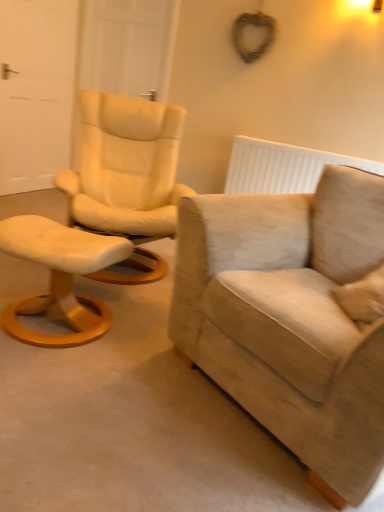
Measure the distance between point (x=259, y=260) and camera.

The distance of point (x=259, y=260) from camera is 1.69 meters.

The image size is (384, 512). What do you see at coordinates (282, 167) in the screenshot?
I see `white textured radiator at upper right` at bounding box center [282, 167].

Find the location of `white fabric stool at left`. white fabric stool at left is located at coordinates (60, 277).

Is beige fabric armchair at right directly adjacent to white wood door at upper left, the 1th door positioned from the right?

No, beige fabric armchair at right is not making contact with white wood door at upper left, the 1th door positioned from the right.

Looking at their sizes, would you say beige fabric armchair at right is wider or thinner than white wood door at upper left, which appears as the 2th door when viewed from the left?

Clearly, beige fabric armchair at right has more width compared to white wood door at upper left, which appears as the 2th door when viewed from the left.

How different are the orientations of beige fabric armchair at right and white wood door at upper left, the 1th door positioned from the right, in degrees?

The facing directions of beige fabric armchair at right and white wood door at upper left, the 1th door positioned from the right, are 26.9 degrees apart.

Can you confirm if beige fabric armchair at right is bigger than white wood door at upper left, which appears as the 2th door when viewed from the left?

Indeed, beige fabric armchair at right has a larger size compared to white wood door at upper left, which appears as the 2th door when viewed from the left.

From the image's perspective, is white wood door at upper left, the 1th door positioned from the right, located above beige fabric armchair at right?

Yes.

Can you see white wood door at upper left, which appears as the 2th door when viewed from the left, touching beige fabric armchair at right?

No, white wood door at upper left, which appears as the 2th door when viewed from the left, is not with beige fabric armchair at right.

Could you tell me if white wood door at upper left, the 1th door positioned from the right, is turned towards beige fabric armchair at right?

No, white wood door at upper left, the 1th door positioned from the right, is not oriented towards beige fabric armchair at right.

From a real-world perspective, does white wood door at upper left, the 1th door positioned from the right, sit lower than beige fabric armchair at right?

No, from a real-world perspective, white wood door at upper left, the 1th door positioned from the right, is not under beige fabric armchair at right.

Looking at this image, does white fabric stool at left have a smaller size compared to beige fabric armchair at right?

Yes, white fabric stool at left is smaller than beige fabric armchair at right.

Is white fabric stool at left behind beige fabric armchair at right?

Yes, white fabric stool at left is behind beige fabric armchair at right.

Is white fabric stool at left with beige fabric armchair at right?

No, white fabric stool at left is not beside beige fabric armchair at right.

Are white textured radiator at upper right and white wood door at upper left, which appears as the 2th door when viewed from the left, making contact?

No, white textured radiator at upper right is not with white wood door at upper left, which appears as the 2th door when viewed from the left.

From the image's perspective, which one is positioned lower, white textured radiator at upper right or white wood door at upper left, which appears as the 2th door when viewed from the left?

white textured radiator at upper right, from the image's perspective.

Is white textured radiator at upper right facing towards white wood door at upper left, which appears as the 2th door when viewed from the left?

No, white textured radiator at upper right is not turned towards white wood door at upper left, which appears as the 2th door when viewed from the left.

Which point is more forward, (243,173) or (94,73)?

Positioned in front is point (243,173).

Is beige fabric armchair at right directly adjacent to white fabric stool at left?

beige fabric armchair at right and white fabric stool at left are clearly separated.

Is beige fabric armchair at right wider than white fabric stool at left?

Indeed, beige fabric armchair at right has a greater width compared to white fabric stool at left.

Is point (314, 268) positioned after point (121, 251)?

Yes, point (314, 268) is behind point (121, 251).

Between white fabric stool at left and white wood door at upper left, which appears as the 2th door when viewed from the left, which one is positioned behind?

white wood door at upper left, which appears as the 2th door when viewed from the left, is behind.

Considering the relative sizes of white fabric stool at left and white wood door at upper left, which appears as the 2th door when viewed from the left, in the image provided, is white fabric stool at left shorter than white wood door at upper left, which appears as the 2th door when viewed from the left,?

Yes, white fabric stool at left is shorter than white wood door at upper left, which appears as the 2th door when viewed from the left.

How different are the orientations of white fabric stool at left and white wood door at upper left, which appears as the 2th door when viewed from the left, in degrees?

9.55 degrees.

Does white fabric stool at left have a larger size compared to white matte door at left, marked as the 2th door in a right-to-left arrangement?

Incorrect, white fabric stool at left is not larger than white matte door at left, marked as the 2th door in a right-to-left arrangement.

Is white fabric stool at left next to white matte door at left, the first door in the left-to-right sequence?

white fabric stool at left and white matte door at left, the first door in the left-to-right sequence, are clearly separated.

Which point is more distant from viewer, (115, 248) or (28, 6)?

The point (28, 6) is more distant.

The width and height of the screenshot is (384, 512). What are the coordinates of `chair below the white wood door at upper left, which appears as the 2th door when viewed from the left (from a real-world perspective)` in the screenshot? It's located at (290, 317).

From the image's perspective, count 2nd doors upward from the beige fabric armchair at right and point to it. Please provide its 2D coordinates.

[(127, 46)]

When comparing their distances from beige fabric armchair at right, does white fabric stool at left or white matte door at left, marked as the 2th door in a right-to-left arrangement, seem further?

Based on the image, white matte door at left, marked as the 2th door in a right-to-left arrangement, appears to be further to beige fabric armchair at right.

Which object lies nearer to the anchor point white fabric stool at left, white wood door at upper left, the 1th door positioned from the right, or white textured radiator at upper right?

The object closer to white fabric stool at left is white textured radiator at upper right.

Looking at the image, which one is located closer to white fabric stool at left, beige fabric armchair at right or white textured radiator at upper right?

Based on the image, beige fabric armchair at right appears to be nearer to white fabric stool at left.

Estimate the real-world distances between objects in this image. Which object is closer to white matte door at left, the first door in the left-to-right sequence, white fabric stool at left or white wood door at upper left, which appears as the 2th door when viewed from the left?

Based on the image, white wood door at upper left, which appears as the 2th door when viewed from the left, appears to be nearer to white matte door at left, the first door in the left-to-right sequence.

Based on their spatial positions, is white fabric stool at left or white matte door at left, marked as the 2th door in a right-to-left arrangement, further from white wood door at upper left, which appears as the 2th door when viewed from the left?

white fabric stool at left is positioned further to the anchor white wood door at upper left, which appears as the 2th door when viewed from the left.

Looking at the image, which one is located closer to white matte door at left, marked as the 2th door in a right-to-left arrangement, white textured radiator at upper right or white wood door at upper left, the 1th door positioned from the right?

Based on the image, white wood door at upper left, the 1th door positioned from the right, appears to be nearer to white matte door at left, marked as the 2th door in a right-to-left arrangement.

Based on their spatial positions, is white fabric stool at left or white textured radiator at upper right further from white matte door at left, marked as the 2th door in a right-to-left arrangement?

Among the two, white fabric stool at left is located further to white matte door at left, marked as the 2th door in a right-to-left arrangement.

When comparing their distances from white matte door at left, marked as the 2th door in a right-to-left arrangement, does white wood door at upper left, which appears as the 2th door when viewed from the left, or beige fabric armchair at right seem closer?

white wood door at upper left, which appears as the 2th door when viewed from the left.

At what (x,y) coordinates should I click in order to perform the action: click on radiator between beige fabric armchair at right and white matte door at left, the first door in the left-to-right sequence, from front to back. Please return your answer as a coordinate pair (x, y). This screenshot has height=512, width=384. Looking at the image, I should click on (282, 167).

Where is `stool situated between white matte door at left, the first door in the left-to-right sequence, and white textured radiator at upper right from left to right`? The image size is (384, 512). stool situated between white matte door at left, the first door in the left-to-right sequence, and white textured radiator at upper right from left to right is located at coordinates (60, 277).

Find the location of a particular element. The image size is (384, 512). stool located between beige fabric armchair at right and white matte door at left, marked as the 2th door in a right-to-left arrangement, in the depth direction is located at coordinates (60, 277).

Identify the location of stool positioned between beige fabric armchair at right and white wood door at upper left, which appears as the 2th door when viewed from the left, from near to far. (60, 277).